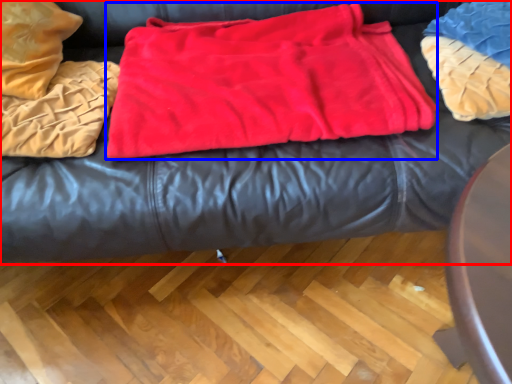
Question: Which object is closer to the camera taking this photo, furniture (highlighted by a red box) or blanket (highlighted by a blue box)?

Choices:
 (A) furniture
 (B) blanket

Answer: (A)